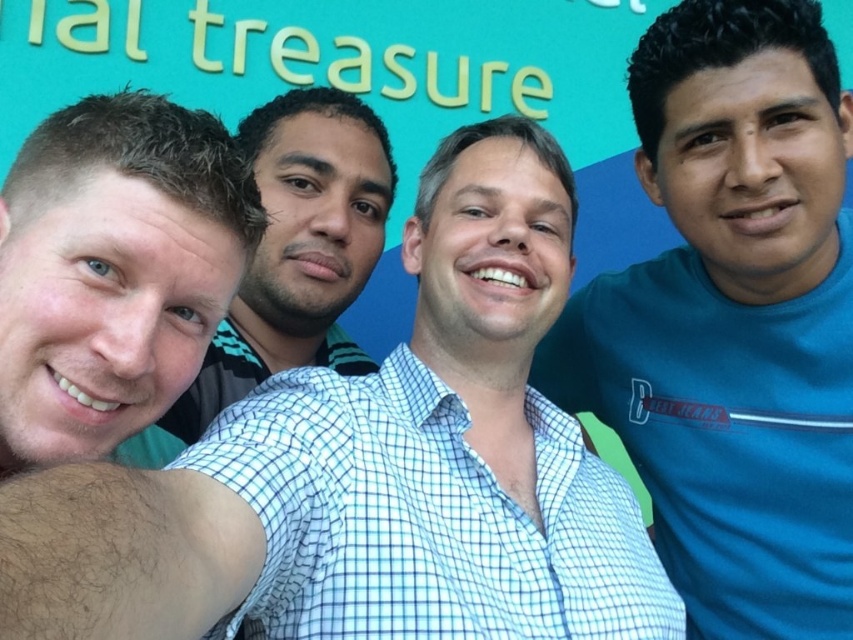
Question: Estimate the real-world distances between objects in this image. Which object is farther from the blue cotton shirt at center?

Choices:
 (A) blue checkered shirt at center
 (B) white checkered shirt at center

Answer: (B)

Question: Which of the following is the closest to the observer?

Choices:
 (A) (679, 51)
 (B) (238, 604)

Answer: (B)

Question: Based on their relative distances, which object is nearer to the white checkered shirt at center?

Choices:
 (A) blue checkered shirt at center
 (B) blue cotton shirt at center

Answer: (A)

Question: Can you confirm if blue checkered shirt at center is wider than white checkered shirt at center?

Choices:
 (A) yes
 (B) no

Answer: (A)

Question: Can you confirm if blue cotton shirt at center is wider than white checkered shirt at center?

Choices:
 (A) no
 (B) yes

Answer: (B)

Question: Does blue checkered shirt at center have a greater width compared to white checkered shirt at center?

Choices:
 (A) no
 (B) yes

Answer: (B)